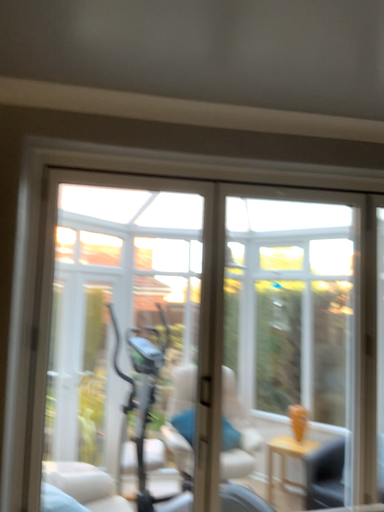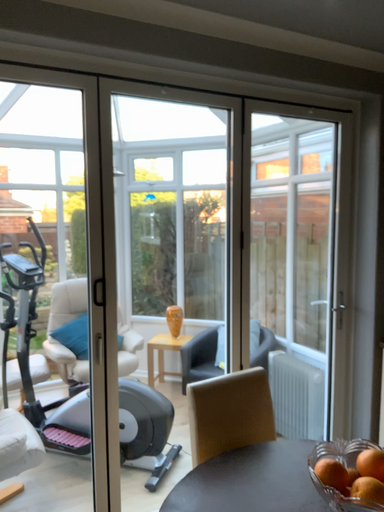
Question: Which way did the camera rotate in the video?

Choices:
 (A) rotated upward
 (B) rotated downward

Answer: (B)